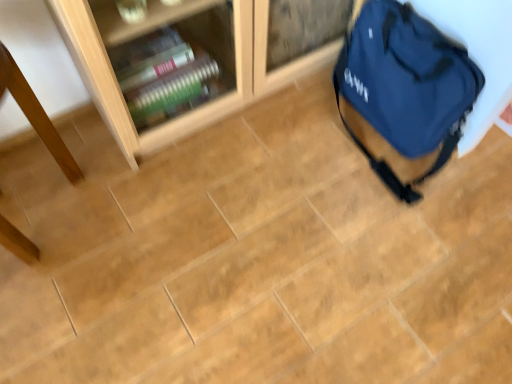
I want to click on blue fabric backpack at right, so click(x=406, y=86).

What is the approximate width of blue fabric backpack at right?

blue fabric backpack at right is 9.92 inches wide.

Describe the element at coordinates (406, 86) in the screenshot. I see `blue fabric backpack at right` at that location.

The height and width of the screenshot is (384, 512). Identify the location of wooden table at left. (35, 114).

This screenshot has height=384, width=512. What do you see at coordinates (35, 114) in the screenshot?
I see `wooden table at left` at bounding box center [35, 114].

Looking at this image, measure the distance between wooden table at left and camera.

The depth of wooden table at left is 32.68 inches.

The image size is (512, 384). In order to click on blue fabric backpack at right in this screenshot , I will do `click(406, 86)`.

Is blue fabric backpack at right to the left of wooden table at left from the viewer's perspective?

No.

Is blue fabric backpack at right positioned before wooden table at left?

No.

Does point (373, 164) come closer to viewer compared to point (14, 67)?

No.

From the image's perspective, which object appears higher, blue fabric backpack at right or wooden table at left?

From the image's view, blue fabric backpack at right is above.

From a real-world perspective, relative to wooden table at left, is blue fabric backpack at right vertically above or below?

In terms of real-world spatial position, blue fabric backpack at right is below wooden table at left.

Which object is thinner, blue fabric backpack at right or wooden table at left?

With smaller width is blue fabric backpack at right.

Can you confirm if blue fabric backpack at right is shorter than wooden table at left?

Indeed, blue fabric backpack at right has a lesser height compared to wooden table at left.

Between blue fabric backpack at right and wooden table at left, which one has smaller size?

blue fabric backpack at right is smaller.

Do you think blue fabric backpack at right is within wooden table at left, or outside of it?

blue fabric backpack at right is not enclosed by wooden table at left.

Is blue fabric backpack at right with wooden table at left?

No.

Could you tell me if blue fabric backpack at right is facing wooden table at left?

Yes, blue fabric backpack at right faces towards wooden table at left.

Measure the distance between blue fabric backpack at right and wooden table at left.

blue fabric backpack at right is 36.26 inches away from wooden table at left.

Identify the location of table that appears on the left of blue fabric backpack at right. The height and width of the screenshot is (384, 512). (35, 114).

Consider the image. Which is more to the left, wooden table at left or blue fabric backpack at right?

wooden table at left is more to the left.

Considering their positions, is wooden table at left located in front of or behind blue fabric backpack at right?

In the image, wooden table at left appears in front of blue fabric backpack at right.

Considering the positions of points (1, 88) and (442, 114), is point (1, 88) closer to camera compared to point (442, 114)?

Yes, point (1, 88) is closer to viewer.

From the image's perspective, which is above, wooden table at left or blue fabric backpack at right?

blue fabric backpack at right.

Consider the image. From a real-world perspective, between wooden table at left and blue fabric backpack at right, who is vertically higher?

wooden table at left, from a real-world perspective.

Considering the relative sizes of wooden table at left and blue fabric backpack at right in the image provided, is wooden table at left wider than blue fabric backpack at right?

Correct, the width of wooden table at left exceeds that of blue fabric backpack at right.

Based on the photo, considering the sizes of objects wooden table at left and blue fabric backpack at right in the image provided, who is taller, wooden table at left or blue fabric backpack at right?

Standing taller between the two is wooden table at left.

Between wooden table at left and blue fabric backpack at right, which one has larger size?

With larger size is wooden table at left.

Is wooden table at left inside or outside of blue fabric backpack at right?

wooden table at left is outside blue fabric backpack at right.

Is there a large distance between wooden table at left and blue fabric backpack at right?

wooden table at left is actually quite close to blue fabric backpack at right.

Does wooden table at left turn towards blue fabric backpack at right?

No, wooden table at left is not oriented towards blue fabric backpack at right.

Where is `backpack behind the wooden table at left`? backpack behind the wooden table at left is located at coordinates (406, 86).

Locate an element on the screen. The height and width of the screenshot is (384, 512). table above the blue fabric backpack at right (from a real-world perspective) is located at coordinates (35, 114).

Where is `backpack above the wooden table at left (from the image's perspective)`? backpack above the wooden table at left (from the image's perspective) is located at coordinates (406, 86).